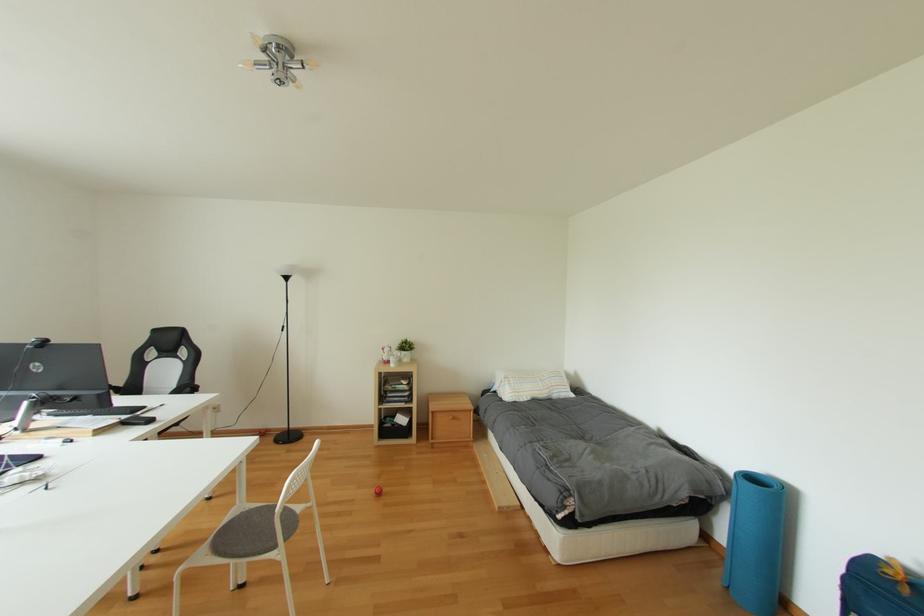
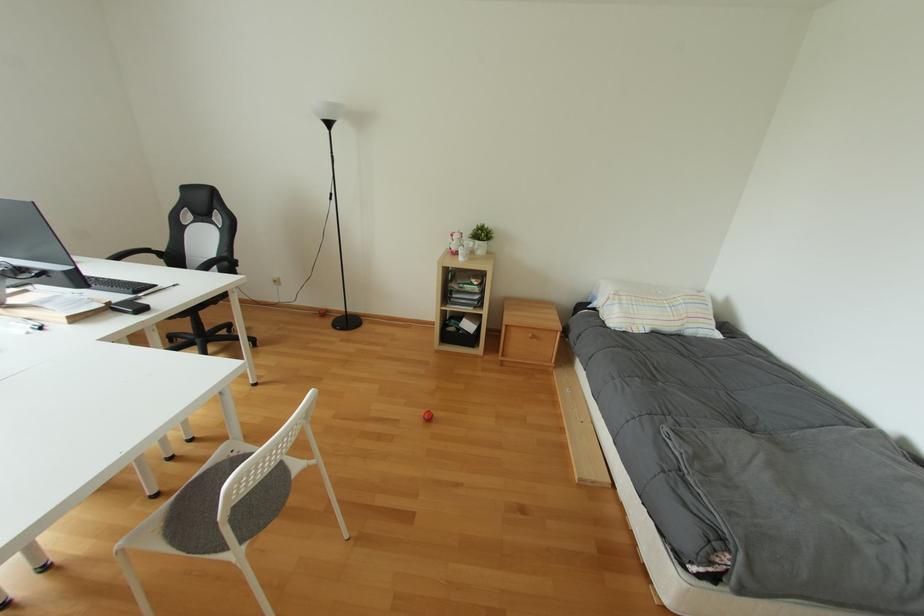
Question: Which direction would the cameraman need to move to produce the second image? Reply with the corresponding letter.

Choices:
 (A) Left
 (B) Right
 (C) Forward
 (D) Backward

Answer: (C)